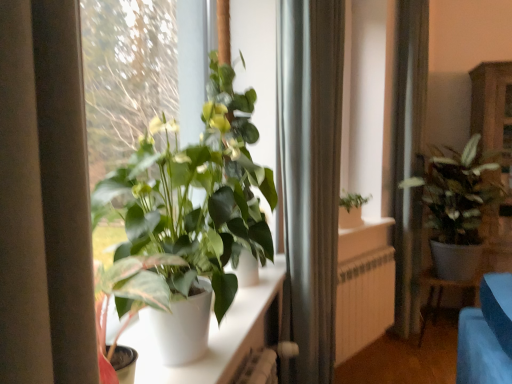
Question: Considering the relative positions of white matte radiator at center and silky white curtain at right, the 2th curtain from the left, in the image provided, is white matte radiator at center behind silky white curtain at right, the 2th curtain from the left,?

Choices:
 (A) yes
 (B) no

Answer: (B)

Question: Can you confirm if white matte radiator at center is thinner than silky white curtain at right, marked as the second curtain in a front-to-back arrangement?

Choices:
 (A) yes
 (B) no

Answer: (A)

Question: Is white matte radiator at center to the right of silky white curtain at right, marked as the second curtain in a front-to-back arrangement, from the viewer's perspective?

Choices:
 (A) yes
 (B) no

Answer: (B)

Question: Is white matte radiator at center wider than silky white curtain at right, marked as the first curtain in a back-to-front arrangement?

Choices:
 (A) yes
 (B) no

Answer: (B)

Question: Considering the relative positions of white matte radiator at center and silky white curtain at right, the 2th curtain from the left, in the image provided, is white matte radiator at center to the left of silky white curtain at right, the 2th curtain from the left, from the viewer's perspective?

Choices:
 (A) yes
 (B) no

Answer: (A)

Question: From the image's perspective, is white matte radiator at center on top of silky white curtain at right, marked as the first curtain in a back-to-front arrangement?

Choices:
 (A) yes
 (B) no

Answer: (B)

Question: From a real-world perspective, is white glossy plant at center positioned under silky white curtain at right, the 2th curtain from the left, based on gravity?

Choices:
 (A) yes
 (B) no

Answer: (A)

Question: Can you confirm if white glossy plant at center is thinner than silky white curtain at right, which appears as the 1th curtain when viewed from the right?

Choices:
 (A) no
 (B) yes

Answer: (B)

Question: From a real-world perspective, is white glossy plant at center positioned over silky white curtain at right, which appears as the 1th curtain when viewed from the right, based on gravity?

Choices:
 (A) no
 (B) yes

Answer: (A)

Question: Would you consider white glossy plant at center to be distant from silky white curtain at right, marked as the second curtain in a front-to-back arrangement?

Choices:
 (A) no
 (B) yes

Answer: (B)

Question: Is white glossy plant at center closer to camera compared to silky white curtain at right, marked as the first curtain in a back-to-front arrangement?

Choices:
 (A) no
 (B) yes

Answer: (B)

Question: Is white glossy plant at center in contact with silky white curtain at right, the 2th curtain from the left?

Choices:
 (A) no
 (B) yes

Answer: (A)

Question: Is silky white curtain at right, the 2th curtain from the left, far away from white matte radiator at center?

Choices:
 (A) no
 (B) yes

Answer: (A)